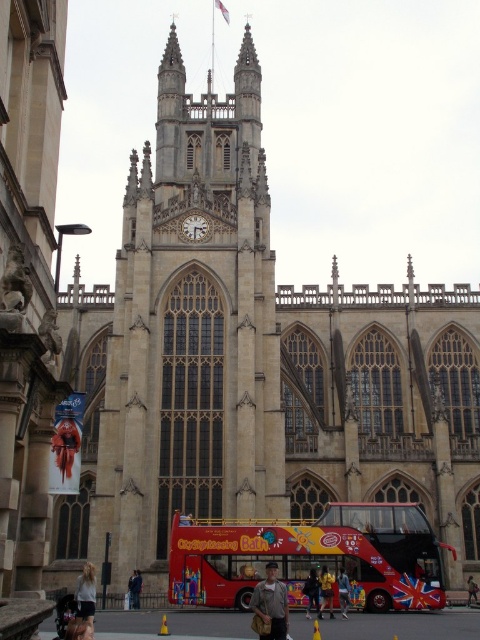
Question: Among these objects, which one is nearest to the camera?

Choices:
 (A) light brown leather jacket at center
 (B) light brown hair at lower left

Answer: (B)

Question: Which of the following is the farthest from the observer?

Choices:
 (A) dark gray fabric jacket at center
 (B) blue denim jacket at center
 (C) yellow fabric bag at center
 (D) light brown hair at lower left

Answer: (B)

Question: From the image, what is the correct spatial relationship of light brown stone tower at center in relation to light brown hair at lower left?

Choices:
 (A) below
 (B) above

Answer: (B)

Question: Is light brown leather jacket at center thinner than dark gray fabric jacket at center?

Choices:
 (A) no
 (B) yes

Answer: (A)

Question: Can you confirm if light brown stone tower at center is positioned to the right of light brown leather jacket at center?

Choices:
 (A) no
 (B) yes

Answer: (A)

Question: Which of these objects is positioned closest to the light brown stone tower at center?

Choices:
 (A) dark gray fabric jacket at center
 (B) light brown hair at lower left
 (C) yellow fabric bag at center

Answer: (C)